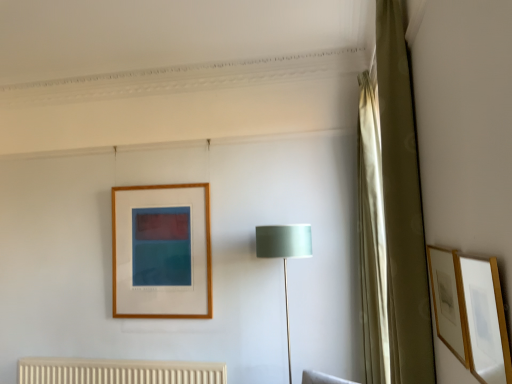
Question: Considering the relative sizes of matte gold picture frame at right, the 2th picture frame from the back, and satin green fabric at center in the image provided, is matte gold picture frame at right, the 2th picture frame from the back, shorter than satin green fabric at center?

Choices:
 (A) no
 (B) yes

Answer: (B)

Question: Can you confirm if matte gold picture frame at right, the 2th picture frame from the back, is wider than satin green fabric at center?

Choices:
 (A) no
 (B) yes

Answer: (A)

Question: Is matte gold picture frame at right, which is the 1th picture frame from front to back, to the left of satin green fabric at center from the viewer's perspective?

Choices:
 (A) yes
 (B) no

Answer: (B)

Question: Can satin green fabric at center be found inside matte gold picture frame at right, which is the 1th picture frame from front to back?

Choices:
 (A) no
 (B) yes

Answer: (A)

Question: Considering the relative sizes of matte gold picture frame at right, the 2th picture frame from the back, and satin green fabric at center in the image provided, is matte gold picture frame at right, the 2th picture frame from the back, smaller than satin green fabric at center?

Choices:
 (A) no
 (B) yes

Answer: (B)

Question: From a real-world perspective, is matte gold picture frame at right, the 2th picture frame from the back, located beneath satin green fabric at center?

Choices:
 (A) no
 (B) yes

Answer: (A)

Question: Is green fabric curtain at right, the first curtain viewed from the front, beside matte gold picture frame at right, which is the 1th picture frame from front to back?

Choices:
 (A) no
 (B) yes

Answer: (A)

Question: Can you confirm if green fabric curtain at right, positioned as the 2th curtain in back-to-front order, is shorter than matte gold picture frame at right, the 2th picture frame from the back?

Choices:
 (A) no
 (B) yes

Answer: (A)

Question: From a real-world perspective, is green fabric curtain at right, the first curtain viewed from the front, under matte gold picture frame at right, which is the 1th picture frame from front to back?

Choices:
 (A) yes
 (B) no

Answer: (B)

Question: Does green fabric curtain at right, the first curtain viewed from the front, contain matte gold picture frame at right, which is the 1th picture frame from front to back?

Choices:
 (A) yes
 (B) no

Answer: (B)

Question: Can you confirm if green fabric curtain at right, the first curtain viewed from the front, is wider than matte gold picture frame at right, the 2th picture frame from the back?

Choices:
 (A) no
 (B) yes

Answer: (B)

Question: Is green fabric curtain at right, the first curtain viewed from the front, positioned with its back to matte gold picture frame at right, which is the 1th picture frame from front to back?

Choices:
 (A) no
 (B) yes

Answer: (A)

Question: Is satin green fabric at center taller than matte gold picture frame at right, which is the 1th picture frame from front to back?

Choices:
 (A) yes
 (B) no

Answer: (A)